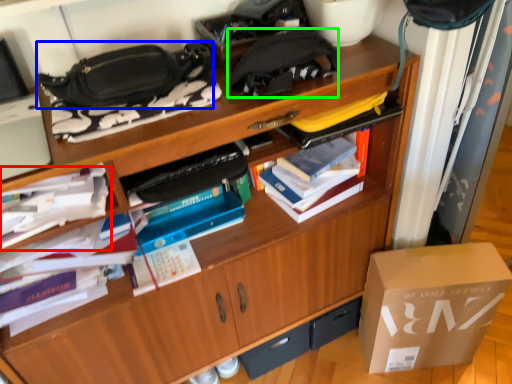
Question: Considering the real-world distances, which object is closest to book (highlighted by a red box)? handbag (highlighted by a blue box) or pouch (highlighted by a green box).

Choices:
 (A) handbag
 (B) pouch

Answer: (A)